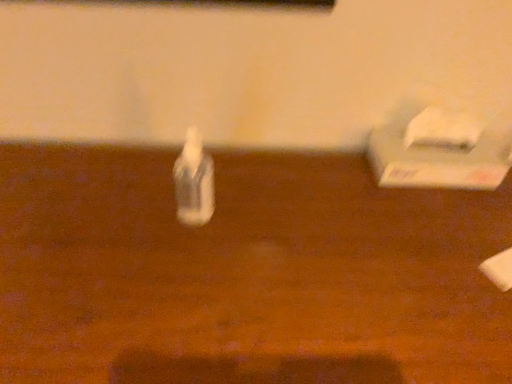
Find the location of a particular element. This screenshot has width=512, height=384. vacant area that lies between transparent plastic bottle at center and white matte tissue box at right is located at coordinates (312, 194).